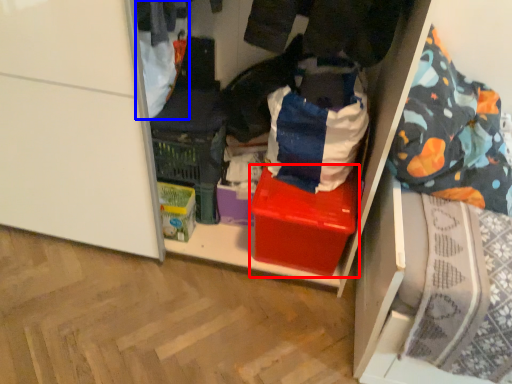
Question: Which of the following is the farthest to the observer, box (highlighted by a red box) or clothing (highlighted by a blue box)?

Choices:
 (A) box
 (B) clothing

Answer: (A)